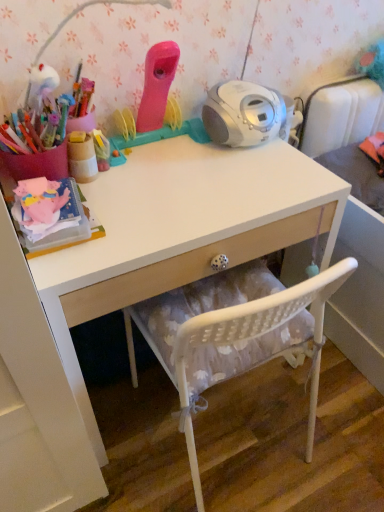
Question: Is white mesh chair at lower center wider than wooden cup at upper left?

Choices:
 (A) no
 (B) yes

Answer: (B)

Question: Could you tell me if white mesh chair at lower center is turned towards wooden cup at upper left?

Choices:
 (A) yes
 (B) no

Answer: (B)

Question: Is white mesh chair at lower center directly adjacent to wooden cup at upper left?

Choices:
 (A) yes
 (B) no

Answer: (B)

Question: Considering the relative sizes of white mesh chair at lower center and wooden cup at upper left in the image provided, is white mesh chair at lower center bigger than wooden cup at upper left?

Choices:
 (A) yes
 (B) no

Answer: (A)

Question: From the image's perspective, is white mesh chair at lower center located above wooden cup at upper left?

Choices:
 (A) no
 (B) yes

Answer: (A)

Question: Which is correct: white glossy desk at center is inside wooden cup at upper left, or outside of it?

Choices:
 (A) outside
 (B) inside

Answer: (A)

Question: Is point (125, 199) positioned closer to the camera than point (71, 140)?

Choices:
 (A) farther
 (B) closer

Answer: (A)

Question: From the image's perspective, is white glossy desk at center positioned above or below wooden cup at upper left?

Choices:
 (A) below
 (B) above

Answer: (A)

Question: Considering the relative positions of white glossy desk at center and wooden cup at upper left in the image provided, is white glossy desk at center to the left or to the right of wooden cup at upper left?

Choices:
 (A) right
 (B) left

Answer: (A)

Question: Based on their positions, is wooden cup at upper left located to the left or right of white glossy desk at center?

Choices:
 (A) left
 (B) right

Answer: (A)

Question: From a real-world perspective, is wooden cup at upper left above or below white glossy desk at center?

Choices:
 (A) below
 (B) above

Answer: (B)

Question: From the image's perspective, is wooden cup at upper left above or below white glossy desk at center?

Choices:
 (A) above
 (B) below

Answer: (A)

Question: Relative to white glossy desk at center, is wooden cup at upper left in front or behind?

Choices:
 (A) behind
 (B) front

Answer: (A)

Question: Is white mesh chair at lower center wider or thinner than white glossy desk at center?

Choices:
 (A) thin
 (B) wide

Answer: (B)

Question: Would you say white mesh chair at lower center is inside or outside white glossy desk at center?

Choices:
 (A) outside
 (B) inside

Answer: (A)